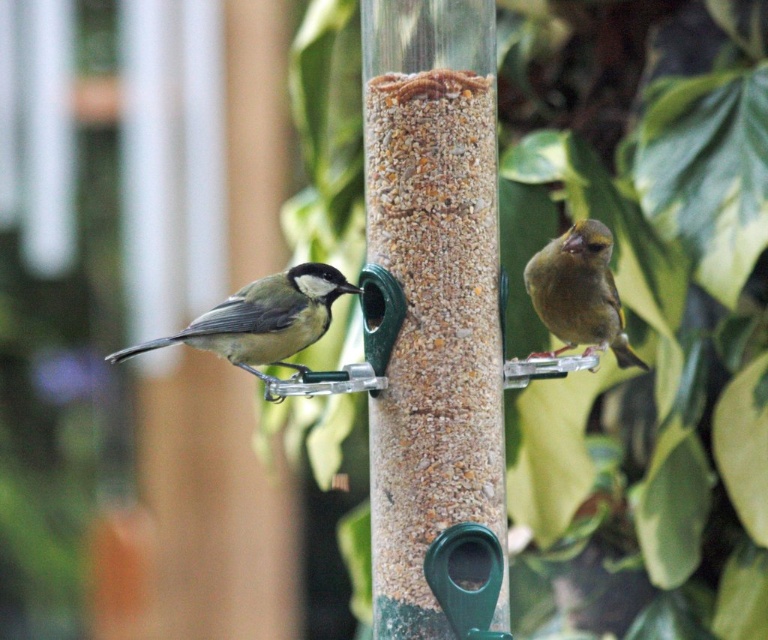
You are a birdwatcher observing the matte gray bird at left and the green matte bird at right near the feeder. Which bird has a wider body according to their positions?

The matte gray bird at left is wider than the green matte bird at right based on their positions.

You are a birdwatcher observing the matte gray bird at left and the green matte bird at right near the bird feeder. Which bird would you describe as larger in size?

The matte gray bird at left is bigger than the green matte bird at right.